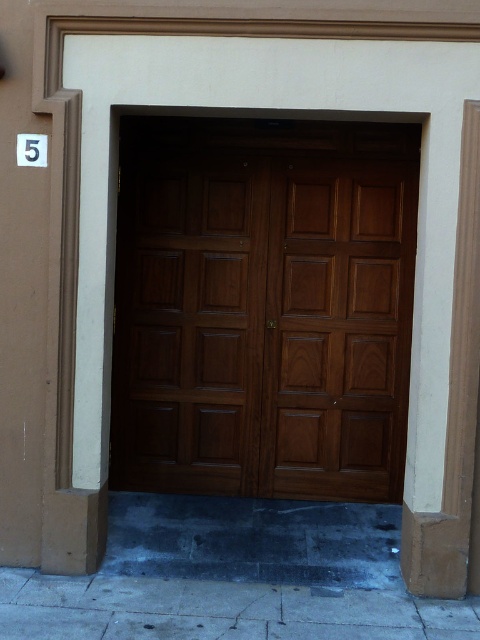
You are standing in front of the building shown in the image. You need to locate the wooden door at center. Where is it positioned in terms of horizontal and vertical coordinates?

The wooden door at center is positioned at the 2D coordinates of point 0.497 horizontally and 0.394 vertically.

You are a delivery person trying to park your bike. The wooden door at center is the entrance to the building. The dark gray concrete pavement at lower center is where you can park. Is the entrance above or below the parking spot?

The wooden door at center is above the dark gray concrete pavement at lower center, so the entrance is above the parking spot.